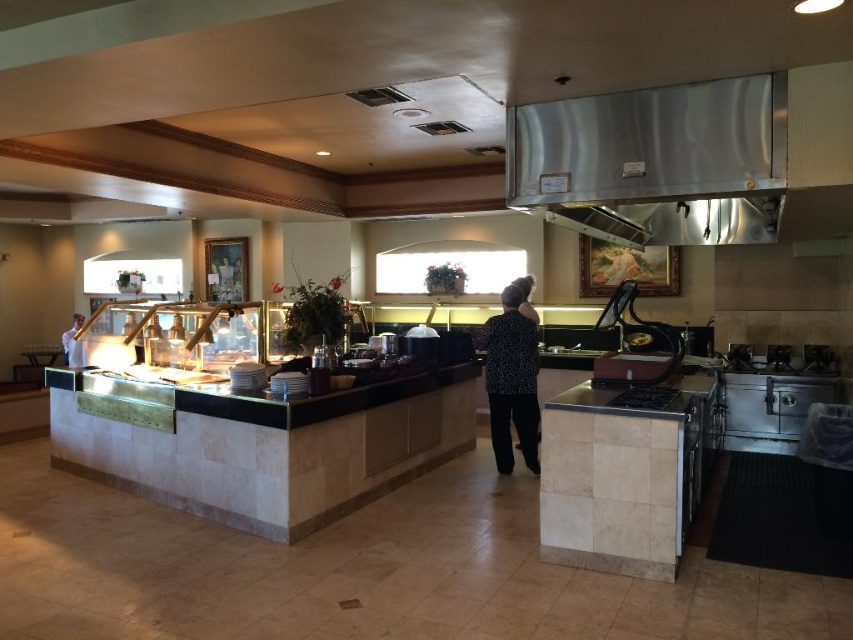
You are a customer in the restaurant and you want to know which object is wider between the stainless steel exhaust hood at upper center and the white shirt at left. Can you tell me?

The stainless steel exhaust hood at upper center is wider than the white shirt at left according to the description.

You are a customer at the buffet and need to choose between wearing a black dotted shirt at center or a white shirt at left to avoid getting sauce stains on your clothes. Which shirt would be less likely to show sauce stains?

The black dotted shirt at center might be wider than white shirt at left, so the black dotted shirt at center could potentially cover more area and might be less likely to show sauce stains compared to the white shirt at left.